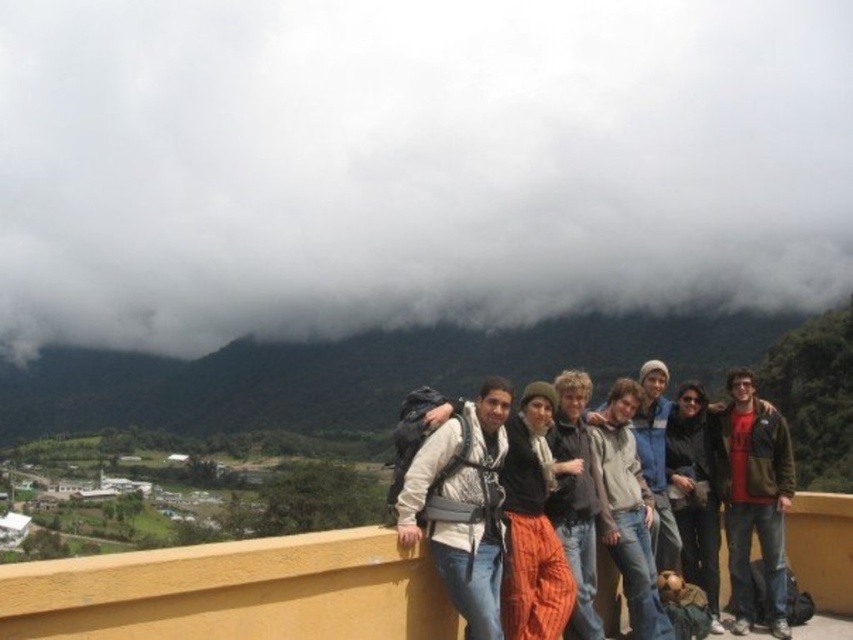
From the picture: Is white fluffy cloud at upper center thinner than matte white jacket at center?

No, white fluffy cloud at upper center is not thinner than matte white jacket at center.

Can you confirm if white fluffy cloud at upper center is wider than matte white jacket at center?

Correct, the width of white fluffy cloud at upper center exceeds that of matte white jacket at center.

Where is `white fluffy cloud at upper center`? The image size is (853, 640). white fluffy cloud at upper center is located at coordinates (413, 163).

Between point (111, 612) and point (442, 420), which one is positioned behind?

Point (442, 420)

Does yellow concrete ledge at center appear under knit orange pants at center?

Correct, yellow concrete ledge at center is located below knit orange pants at center.

What do you see at coordinates (233, 593) in the screenshot?
I see `yellow concrete ledge at center` at bounding box center [233, 593].

At what (x,y) coordinates should I click in order to perform the action: click on yellow concrete ledge at center. Please return your answer as a coordinate pair (x, y). The width and height of the screenshot is (853, 640). Looking at the image, I should click on (233, 593).

Is point (815, 524) positioned after point (729, 572)?

Yes, it is behind point (729, 572).

Can you confirm if yellow concrete ledge at center is smaller than red jacket at right?

Incorrect, yellow concrete ledge at center is not smaller in size than red jacket at right.

In order to click on yellow concrete ledge at center in this screenshot , I will do `click(233, 593)`.